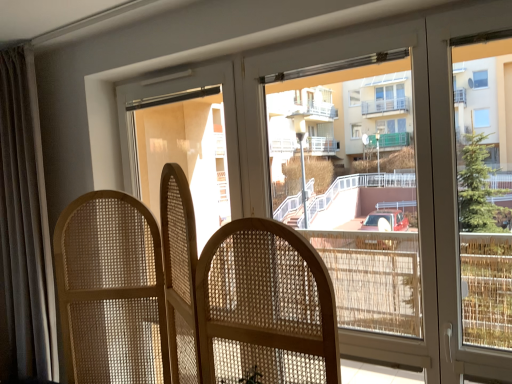
What do you see at coordinates (25, 221) in the screenshot?
I see `dark gray fabric curtain at left` at bounding box center [25, 221].

In order to face dark gray fabric curtain at left, should I rotate leftwards or rightwards?

Rotate your view left by about 30.700°.

Locate an element on the screen. This screenshot has height=384, width=512. dark gray fabric curtain at left is located at coordinates (25, 221).

Where is `natural wood screen at center`? The image size is (512, 384). natural wood screen at center is located at coordinates (237, 290).

What do you see at coordinates (237, 290) in the screenshot? I see `natural wood screen at center` at bounding box center [237, 290].

Identify the location of dark gray fabric curtain at left. This screenshot has width=512, height=384. (25, 221).

In the image, is natural wood screen at center on the left side or the right side of dark gray fabric curtain at left?

natural wood screen at center is to the right of dark gray fabric curtain at left.

Between natural wood screen at center and dark gray fabric curtain at left, which one is positioned behind?

dark gray fabric curtain at left is behind.

Does point (327, 343) come behind point (20, 60)?

No, it is in front of (20, 60).

From the image's perspective, is natural wood screen at center below dark gray fabric curtain at left?

Yes, from the image's perspective, natural wood screen at center is below dark gray fabric curtain at left.

From a real-world perspective, between natural wood screen at center and dark gray fabric curtain at left, who is vertically higher?

dark gray fabric curtain at left, from a real-world perspective.

Considering the sizes of objects natural wood screen at center and dark gray fabric curtain at left in the image provided, who is thinner, natural wood screen at center or dark gray fabric curtain at left?

dark gray fabric curtain at left is thinner.

Considering the relative sizes of natural wood screen at center and dark gray fabric curtain at left in the image provided, is natural wood screen at center taller than dark gray fabric curtain at left?

In fact, natural wood screen at center may be shorter than dark gray fabric curtain at left.

Considering the sizes of objects natural wood screen at center and dark gray fabric curtain at left in the image provided, who is smaller, natural wood screen at center or dark gray fabric curtain at left?

With smaller size is dark gray fabric curtain at left.

Is natural wood screen at center situated inside dark gray fabric curtain at left or outside?

natural wood screen at center exists outside the volume of dark gray fabric curtain at left.

Is natural wood screen at center placed right next to dark gray fabric curtain at left?

No, natural wood screen at center is not making contact with dark gray fabric curtain at left.

Is natural wood screen at center turned away from dark gray fabric curtain at left?

No, natural wood screen at center's orientation is not away from dark gray fabric curtain at left.

The image size is (512, 384). In order to click on curtain lying behind the natural wood screen at center in this screenshot , I will do `click(25, 221)`.

Considering the positions of objects dark gray fabric curtain at left and natural wood screen at center in the image provided, who is more to the right, dark gray fabric curtain at left or natural wood screen at center?

From the viewer's perspective, natural wood screen at center appears more on the right side.

Considering their positions, is dark gray fabric curtain at left located in front of or behind natural wood screen at center?

dark gray fabric curtain at left is positioned farther from the viewer than natural wood screen at center.

Which is nearer, (26, 163) or (228, 270)?

The point (228, 270) is closer.

From the image's perspective, does dark gray fabric curtain at left appear lower than natural wood screen at center?

Actually, dark gray fabric curtain at left appears above natural wood screen at center in the image.

In the scene shown: From a real-world perspective, is dark gray fabric curtain at left over natural wood screen at center?

Yes, from a real-world perspective, dark gray fabric curtain at left is on top of natural wood screen at center.

Considering the relative sizes of dark gray fabric curtain at left and natural wood screen at center in the image provided, is dark gray fabric curtain at left thinner than natural wood screen at center?

Indeed, dark gray fabric curtain at left has a lesser width compared to natural wood screen at center.

Does dark gray fabric curtain at left have a greater height compared to natural wood screen at center?

Yes.

In terms of size, does dark gray fabric curtain at left appear bigger or smaller than natural wood screen at center?

In the image, dark gray fabric curtain at left appears to be smaller than natural wood screen at center.

Is dark gray fabric curtain at left inside or outside of natural wood screen at center?

dark gray fabric curtain at left is outside natural wood screen at center.

Is dark gray fabric curtain at left next to natural wood screen at center?

No, dark gray fabric curtain at left is not in contact with natural wood screen at center.

Is dark gray fabric curtain at left oriented towards natural wood screen at center?

No, dark gray fabric curtain at left is not facing towards natural wood screen at center.

How different are the orientations of dark gray fabric curtain at left and natural wood screen at center in degrees?

The angular difference between dark gray fabric curtain at left and natural wood screen at center is 4.18 degrees.

The height and width of the screenshot is (384, 512). What are the coordinates of `rocking chair located below the dark gray fabric curtain at left (from the image's perspective)` in the screenshot? It's located at pos(237,290).

Locate an element on the screen. curtain to the left of natural wood screen at center is located at coordinates (25, 221).

Image resolution: width=512 pixels, height=384 pixels. In order to click on rocking chair on the right of dark gray fabric curtain at left in this screenshot , I will do `click(237, 290)`.